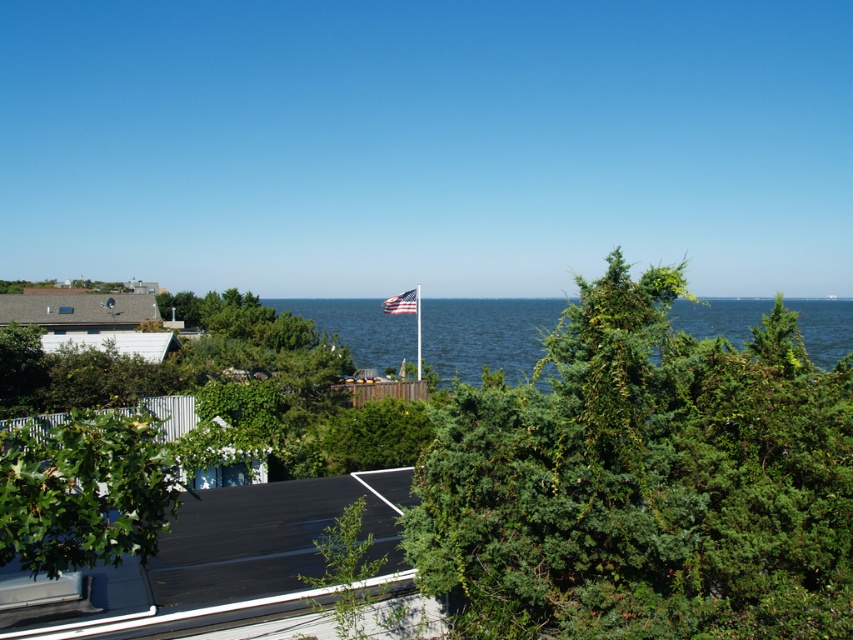
Is blue water at center smaller than american flag at center?

No.

At what (x,y) coordinates should I click in order to perform the action: click on blue water at center. Please return your answer as a coordinate pair (x, y). This screenshot has width=853, height=640. Looking at the image, I should click on (486, 333).

Where is `blue water at center`? The height and width of the screenshot is (640, 853). blue water at center is located at coordinates (486, 333).

Does green textured tree at center have a greater height compared to american flag at center?

In fact, green textured tree at center may be shorter than american flag at center.

Is point (512, 554) more distant than point (395, 301)?

That is False.

What are the coordinates of `green textured tree at center` in the screenshot? It's located at (643, 483).

Is green textured tree at center taller than blue water at center?

No, green textured tree at center is not taller than blue water at center.

Does green textured tree at center have a larger size compared to blue water at center?

No.

Is point (756, 381) in front of point (549, 323)?

Yes, point (756, 381) is closer to viewer.

The height and width of the screenshot is (640, 853). In order to click on green textured tree at center in this screenshot , I will do `click(643, 483)`.